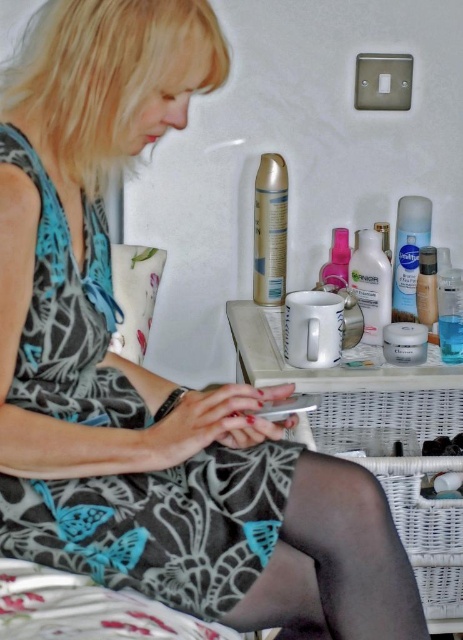
Does black tights at lower center lie behind matte plastic foundation at center?

No, black tights at lower center is closer to the viewer.

Between point (331, 593) and point (425, 314), which one is positioned behind?

The point (425, 314) is behind.

What do you see at coordinates (335, 561) in the screenshot?
I see `black tights at lower center` at bounding box center [335, 561].

At what (x,y) coordinates should I click in order to perform the action: click on black tights at lower center. Please return your answer as a coordinate pair (x, y). Image resolution: width=463 pixels, height=640 pixels. Looking at the image, I should click on (335, 561).

Can you confirm if white glossy lotion at center is taller than pink plastic bottle at upper center?

Yes, white glossy lotion at center is taller than pink plastic bottle at upper center.

Identify the location of white glossy lotion at center. The height and width of the screenshot is (640, 463). (370, 284).

Is printed fabric dress at center positioned before silver metallic spray can at upper center?

Yes, it is.

The height and width of the screenshot is (640, 463). Identify the location of printed fabric dress at center. (158, 524).

Is point (255, 496) positioned in front of point (269, 184)?

That is True.

Locate an element on the screen. printed fabric dress at center is located at coordinates (158, 524).